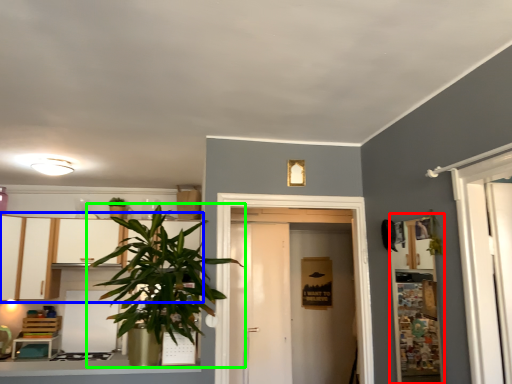
Question: Which is nearer to the shelf (highlighted by a red box)? dresser (highlighted by a blue box) or houseplant (highlighted by a green box).

Choices:
 (A) dresser
 (B) houseplant

Answer: (B)